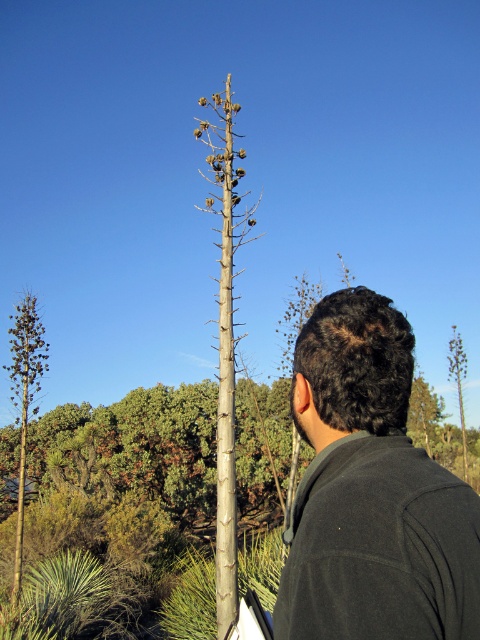
You are standing in a forest and want to find the tallest tree between the bare wood tree at center and the green leafy tree at right. Which tree should you look up to?

The bare wood tree at center is much taller than the green leafy tree at right, so you should look up at the bare wood tree at center.